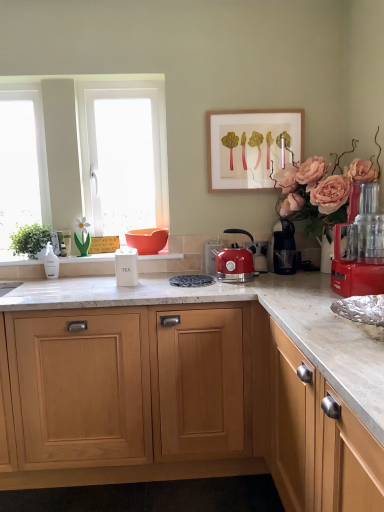
At what (x,y) coordinates should I click in order to perform the action: click on vacant space situated above light wood cabinet at center (from a real-world perspective). Please return your answer as a coordinate pair (x, y). Looking at the image, I should click on (196, 283).